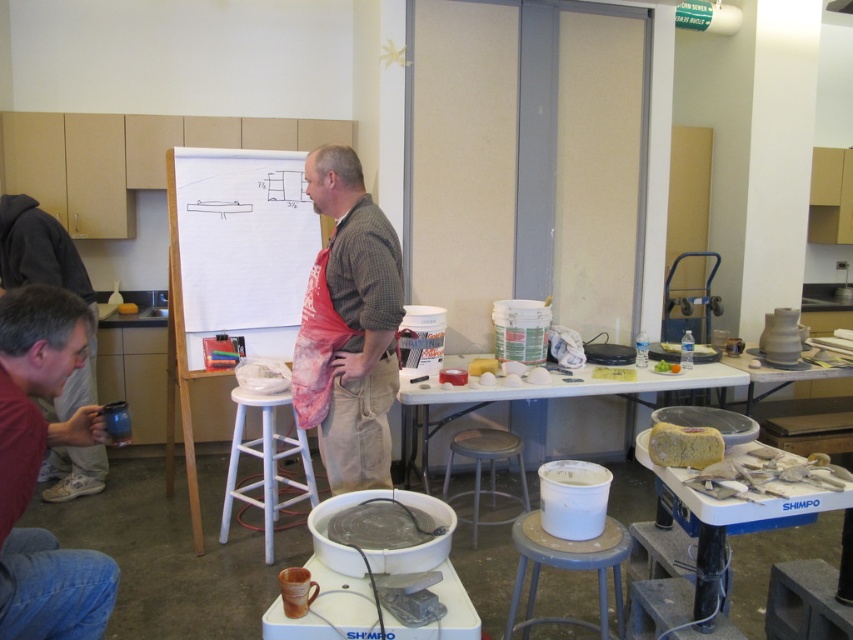
Is white plastic bar stool at center further to the viewer compared to matte gray stool at center?

No, white plastic bar stool at center is in front of matte gray stool at center.

Is point (236, 458) positioned behind point (473, 531)?

That is False.

Locate an element on the screen. Image resolution: width=853 pixels, height=640 pixels. white plastic bar stool at center is located at coordinates (265, 465).

This screenshot has height=640, width=853. In order to click on white plastic bar stool at center in this screenshot , I will do `click(265, 465)`.

Does white paperboard at center have a smaller size compared to white plastic table at center?

Yes.

The width and height of the screenshot is (853, 640). In order to click on white paperboard at center in this screenshot , I will do `click(236, 250)`.

The image size is (853, 640). What do you see at coordinates (236, 250) in the screenshot?
I see `white paperboard at center` at bounding box center [236, 250].

Image resolution: width=853 pixels, height=640 pixels. In order to click on white paperboard at center in this screenshot , I will do `click(236, 250)`.

Which of these two, red apron at center or white glossy table at center, stands shorter?

white glossy table at center is shorter.

Can you confirm if red apron at center is positioned to the right of white glossy table at center?

In fact, red apron at center is to the left of white glossy table at center.

Image resolution: width=853 pixels, height=640 pixels. Identify the location of red apron at center. (357, 323).